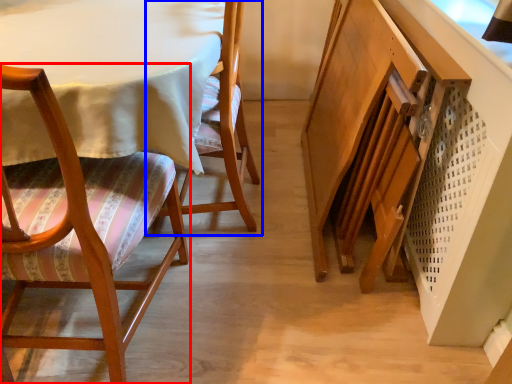
Question: Which point is closer to the camera, chair (highlighted by a red box) or chair (highlighted by a blue box)?

Choices:
 (A) chair
 (B) chair

Answer: (A)